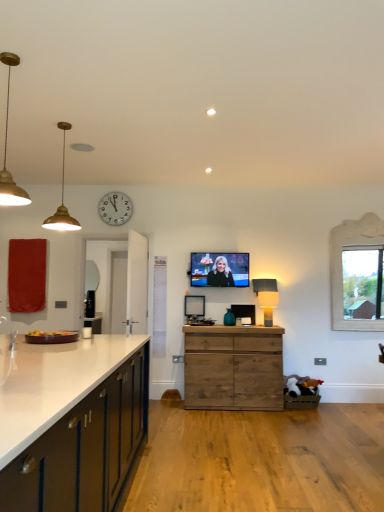
Question: From a real-world perspective, is red fabric curtain at left positioned over white wooden clock at upper center based on gravity?

Choices:
 (A) yes
 (B) no

Answer: (B)

Question: Is red fabric curtain at left facing away from white wooden clock at upper center?

Choices:
 (A) yes
 (B) no

Answer: (B)

Question: Is red fabric curtain at left taller than white wooden clock at upper center?

Choices:
 (A) yes
 (B) no

Answer: (A)

Question: From the image's perspective, is red fabric curtain at left located above white wooden clock at upper center?

Choices:
 (A) no
 (B) yes

Answer: (A)

Question: Is red fabric curtain at left far away from white wooden clock at upper center?

Choices:
 (A) no
 (B) yes

Answer: (B)

Question: Looking at the image, does white glossy cabinet at left, marked as the first cabinetry in a front-to-back arrangement, seem bigger or smaller compared to matte black lamp at center, the first lamp in the back-to-front sequence?

Choices:
 (A) small
 (B) big

Answer: (B)

Question: Relative to matte black lamp at center, the first lamp in the back-to-front sequence, is white glossy cabinet at left, the 1th cabinetry positioned from the left, in front or behind?

Choices:
 (A) behind
 (B) front

Answer: (B)

Question: Considering the relative positions of white glossy cabinet at left, the 1th cabinetry positioned from the left, and matte black lamp at center, the third lamp positioned from the left, in the image provided, is white glossy cabinet at left, the 1th cabinetry positioned from the left, to the left or to the right of matte black lamp at center, the third lamp positioned from the left,?

Choices:
 (A) right
 (B) left

Answer: (B)

Question: Is point (91, 499) positioned closer to the camera than point (273, 296)?

Choices:
 (A) closer
 (B) farther

Answer: (A)

Question: In the image, is white glossy cabinet at left, the 1th cabinetry positioned from the left, on the left side or the right side of matte silver mirror at left?

Choices:
 (A) left
 (B) right

Answer: (B)

Question: Considering the positions of white glossy cabinet at left, the second cabinetry in the back-to-front sequence, and matte silver mirror at left in the image, is white glossy cabinet at left, the second cabinetry in the back-to-front sequence, wider or thinner than matte silver mirror at left?

Choices:
 (A) wide
 (B) thin

Answer: (A)

Question: From a real-world perspective, is white glossy cabinet at left, marked as the first cabinetry in a front-to-back arrangement, positioned above or below matte silver mirror at left?

Choices:
 (A) below
 (B) above

Answer: (A)

Question: Which is correct: white glossy cabinet at left, the 1th cabinetry positioned from the left, is inside matte silver mirror at left, or outside of it?

Choices:
 (A) inside
 (B) outside

Answer: (B)

Question: Based on their sizes in the image, would you say wooden picture frame at center, placed as the second picture frame when sorted from top to bottom, is bigger or smaller than white wooden clock at upper center?

Choices:
 (A) big
 (B) small

Answer: (B)

Question: From a real-world perspective, is wooden picture frame at center, positioned as the second picture frame in bottom-to-top order, positioned above or below white wooden clock at upper center?

Choices:
 (A) above
 (B) below

Answer: (B)